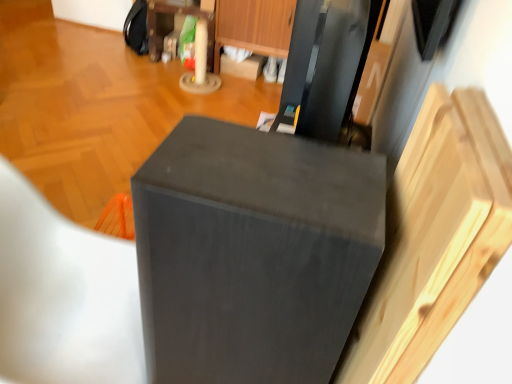
This screenshot has height=384, width=512. I want to click on wooden drawer at upper center, so click(254, 25).

What do you see at coordinates (64, 295) in the screenshot?
I see `matte black folding chair at lower left` at bounding box center [64, 295].

The height and width of the screenshot is (384, 512). I want to click on matte wood dresser at upper center, so click(x=233, y=26).

This screenshot has height=384, width=512. Identify the location of matte black speaker at center. (253, 253).

Is wooden drawer at upper center bigger than matte black folding chair at lower left?

No.

Is the depth of wooden drawer at upper center greater than that of matte black folding chair at lower left?

Yes, wooden drawer at upper center is behind matte black folding chair at lower left.

Considering the positions of objects wooden drawer at upper center and matte black folding chair at lower left in the image provided, who is more to the right, wooden drawer at upper center or matte black folding chair at lower left?

wooden drawer at upper center is more to the right.

Considering the sizes of wooden drawer at upper center and matte black folding chair at lower left in the image, is wooden drawer at upper center taller or shorter than matte black folding chair at lower left?

Considering their sizes, wooden drawer at upper center has less height than matte black folding chair at lower left.

Is point (260, 19) closer to camera compared to point (273, 48)?

Yes, point (260, 19) is in front of point (273, 48).

Between wooden drawer at upper center and matte wood dresser at upper center, which one appears on the right side from the viewer's perspective?

Positioned to the right is wooden drawer at upper center.

From the image's perspective, is wooden drawer at upper center located above or below matte wood dresser at upper center?

Clearly, from the image's perspective, wooden drawer at upper center is below matte wood dresser at upper center.

Does matte black folding chair at lower left contain wooden drawer at upper center?

No, wooden drawer at upper center is not surrounded by matte black folding chair at lower left.

Who is taller, matte black folding chair at lower left or wooden drawer at upper center?

matte black folding chair at lower left.

Considering the relative sizes of matte black folding chair at lower left and wooden drawer at upper center in the image provided, is matte black folding chair at lower left bigger than wooden drawer at upper center?

Correct, matte black folding chair at lower left is larger in size than wooden drawer at upper center.

Is the position of matte black folding chair at lower left less distant than that of wooden drawer at upper center?

Yes, it is in front of wooden drawer at upper center.

Is point (267, 32) closer to camera compared to point (291, 259)?

That is False.

Considering the relative sizes of wooden drawer at upper center and matte black speaker at center in the image provided, is wooden drawer at upper center taller than matte black speaker at center?

Incorrect, the height of wooden drawer at upper center is not larger of that of matte black speaker at center.

Considering the positions of objects wooden drawer at upper center and matte black speaker at center in the image provided, who is more to the left, wooden drawer at upper center or matte black speaker at center?

matte black speaker at center is more to the left.

In order to click on drawer below the matte black speaker at center (from a real-world perspective) in this screenshot , I will do `click(254, 25)`.

The image size is (512, 384). I want to click on drawer above the matte wood dresser at upper center (from a real-world perspective), so click(254, 25).

Can you tell me how much matte wood dresser at upper center and wooden drawer at upper center differ in facing direction?

0.436 degrees.

Can you see matte wood dresser at upper center touching wooden drawer at upper center?

Indeed, matte wood dresser at upper center and wooden drawer at upper center are beside each other and touching.

From a real-world perspective, is matte black folding chair at lower left below matte wood dresser at upper center?

No, from a real-world perspective, matte black folding chair at lower left is not beneath matte wood dresser at upper center.

Is matte black folding chair at lower left placed right next to matte wood dresser at upper center?

No, matte black folding chair at lower left is not beside matte wood dresser at upper center.

Is matte wood dresser at upper center at the back of matte black folding chair at lower left?

No, matte wood dresser at upper center is not at the back of matte black folding chair at lower left.

Does matte black folding chair at lower left appear on the right side of matte wood dresser at upper center?

Indeed, matte black folding chair at lower left is positioned on the right side of matte wood dresser at upper center.

Can you confirm if matte wood dresser at upper center is positioned to the left of matte black folding chair at lower left?

Yes, matte wood dresser at upper center is to the left of matte black folding chair at lower left.

Do you think matte wood dresser at upper center is within matte black folding chair at lower left, or outside of it?

matte wood dresser at upper center cannot be found inside matte black folding chair at lower left.

How many degrees apart are the facing directions of matte wood dresser at upper center and matte black folding chair at lower left?

There is a 89.9-degree angle between the facing directions of matte wood dresser at upper center and matte black folding chair at lower left.

In terms of size, does matte wood dresser at upper center appear bigger or smaller than matte black folding chair at lower left?

Clearly, matte wood dresser at upper center is smaller in size than matte black folding chair at lower left.

Find the location of a particular element. Image resolution: width=512 pixels, height=384 pixels. folding chair to the left of wooden drawer at upper center is located at coordinates (64, 295).

Locate an element on the screen. This screenshot has width=512, height=384. drawer to the right of matte wood dresser at upper center is located at coordinates point(254,25).

Estimate the real-world distances between objects in this image. Which object is closer to wooden drawer at upper center, matte wood dresser at upper center or matte black folding chair at lower left?

Based on the image, matte wood dresser at upper center appears to be nearer to wooden drawer at upper center.

Estimate the real-world distances between objects in this image. Which object is closer to matte black speaker at center, matte black folding chair at lower left or matte wood dresser at upper center?

Among the two, matte black folding chair at lower left is located nearer to matte black speaker at center.

Estimate the real-world distances between objects in this image. Which object is further from matte black speaker at center, matte black folding chair at lower left or wooden drawer at upper center?

The object further to matte black speaker at center is wooden drawer at upper center.

Looking at the image, which one is located further to matte wood dresser at upper center, matte black folding chair at lower left or wooden drawer at upper center?

matte black folding chair at lower left is further to matte wood dresser at upper center.

Considering their positions, is matte black folding chair at lower left positioned further to wooden drawer at upper center than matte wood dresser at upper center?

matte black folding chair at lower left lies further to wooden drawer at upper center than the other object.

When comparing their distances from wooden drawer at upper center, does matte black folding chair at lower left or matte black speaker at center seem closer?

matte black folding chair at lower left lies closer to wooden drawer at upper center than the other object.

When comparing their distances from matte black folding chair at lower left, does matte black speaker at center or matte wood dresser at upper center seem closer?

The object closer to matte black folding chair at lower left is matte black speaker at center.

Which object lies nearer to the anchor point matte black folding chair at lower left, wooden drawer at upper center or matte black speaker at center?

matte black speaker at center is closer to matte black folding chair at lower left.

Image resolution: width=512 pixels, height=384 pixels. I want to click on drawer located between matte black folding chair at lower left and matte wood dresser at upper center in the depth direction, so click(x=254, y=25).

The height and width of the screenshot is (384, 512). What are the coordinates of `drawer between matte black speaker at center and matte wood dresser at upper center from front to back` in the screenshot? It's located at (254, 25).

Locate an element on the screen. folding chair between matte black speaker at center and wooden drawer at upper center in the front-back direction is located at coordinates (64, 295).

I want to click on folding chair between matte black speaker at center and matte wood dresser at upper center from front to back, so click(x=64, y=295).